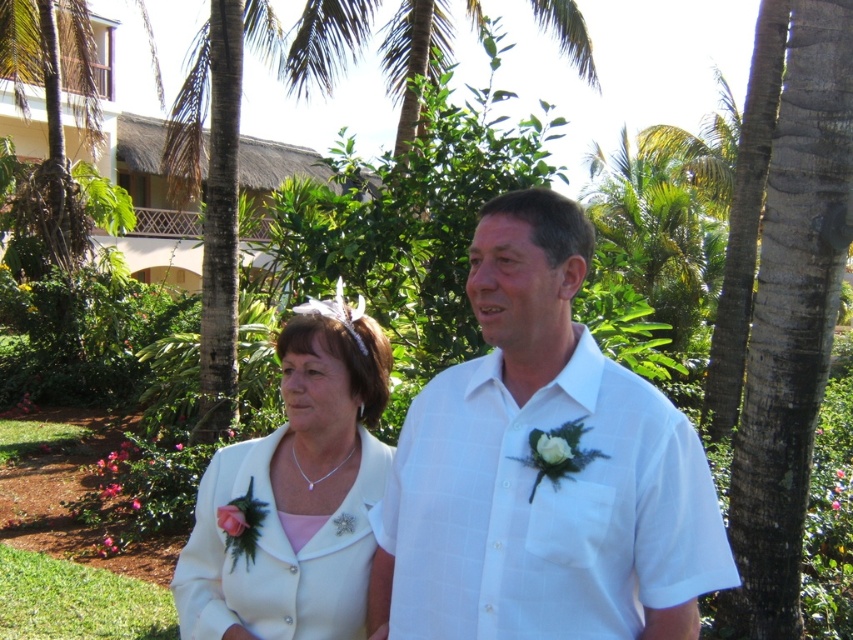
Question: Does white cotton shirt at center have a greater width compared to white satin jacket at center?

Choices:
 (A) no
 (B) yes

Answer: (B)

Question: Which of the following is the farthest from the observer?

Choices:
 (A) white cotton shirt at center
 (B) white satin jacket at center

Answer: (B)

Question: Can you confirm if white cotton shirt at center is positioned above white satin jacket at center?

Choices:
 (A) no
 (B) yes

Answer: (B)

Question: Where is white cotton shirt at center located in relation to white satin jacket at center in the image?

Choices:
 (A) below
 (B) above

Answer: (B)

Question: Which point is closer to the camera taking this photo?

Choices:
 (A) (480, 298)
 (B) (227, 609)

Answer: (A)